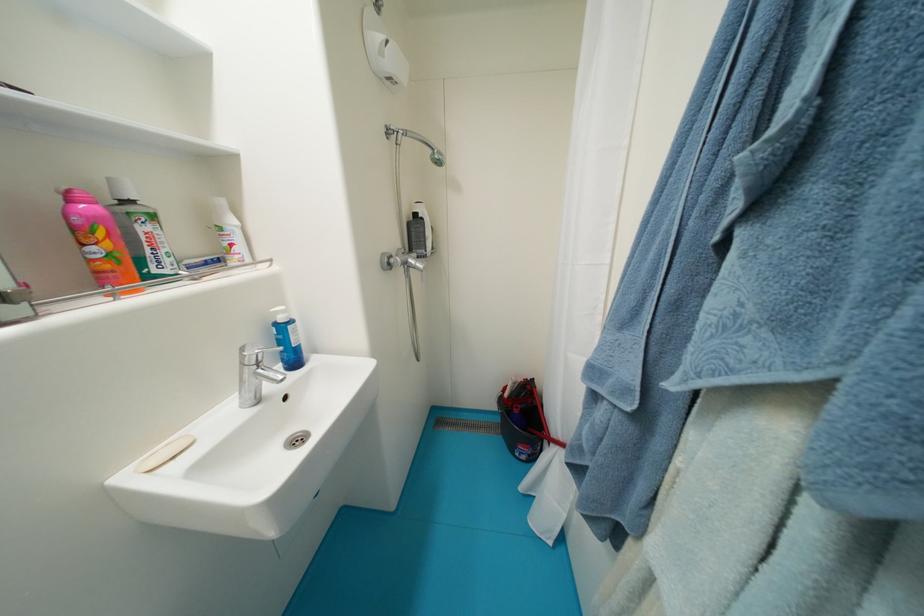
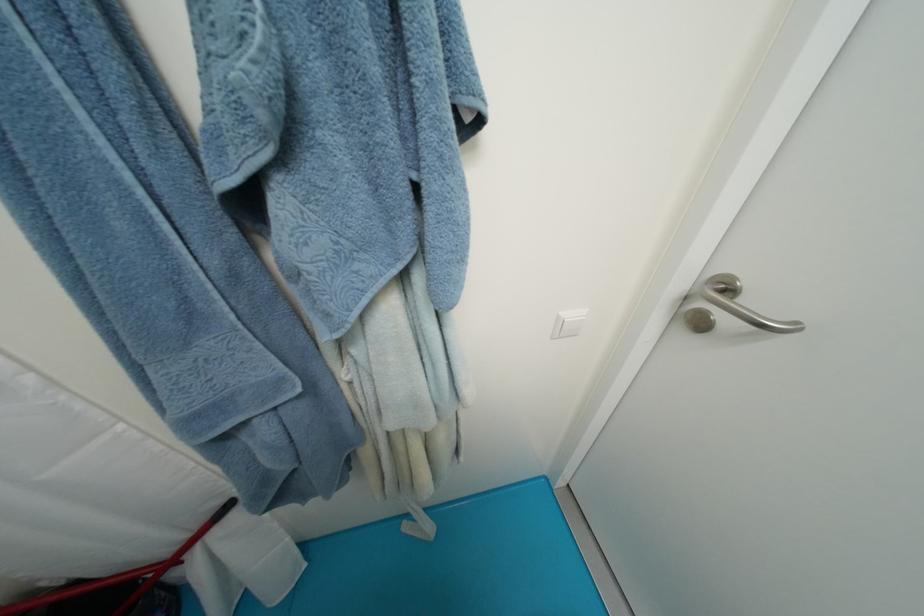
The first image is from the beginning of the video and the second image is from the end. How did the camera likely rotate when shooting the video?

The camera's rotation is toward right-down.